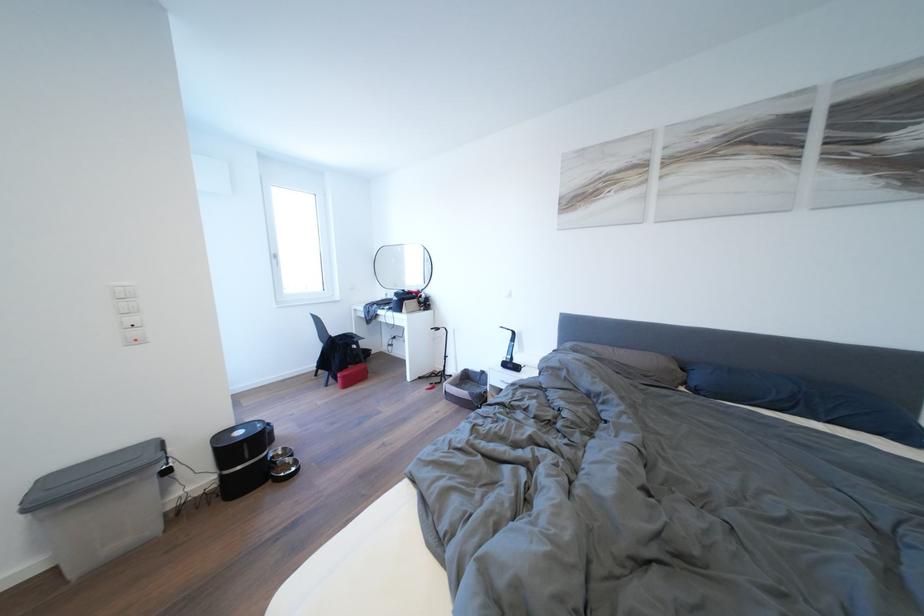
Where would you lift the grey bin lid? Please return your answer as a coordinate pair (x, y).

(91, 475)